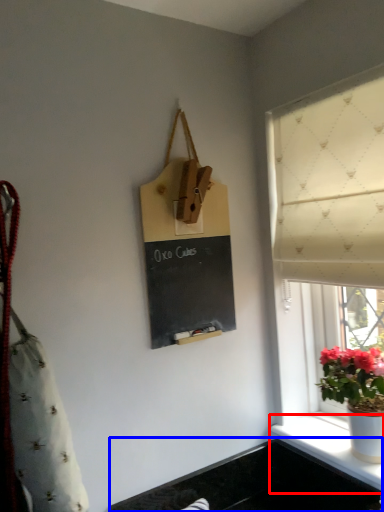
Question: Which point is further to the camera, window sill (highlighted by a red box) or sink (highlighted by a blue box)?

Choices:
 (A) window sill
 (B) sink

Answer: (B)